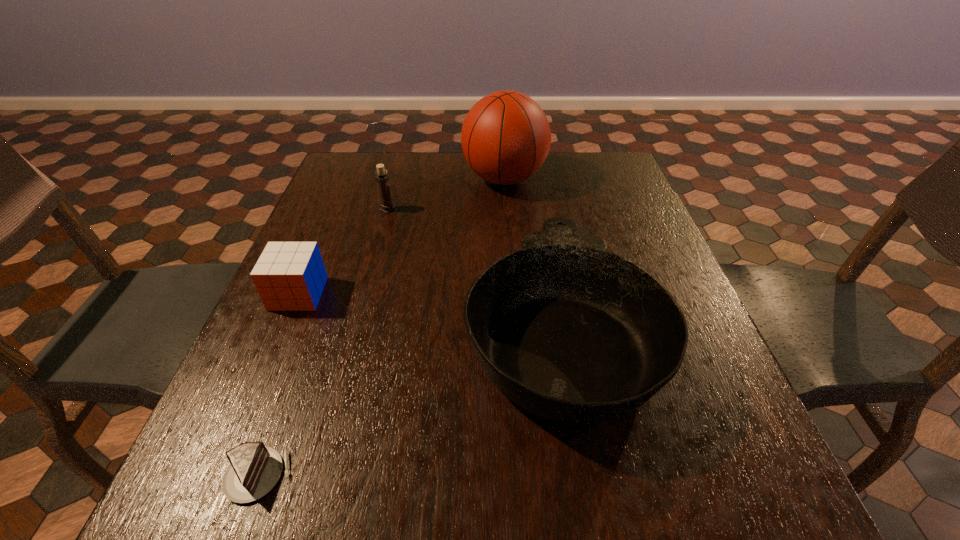
At what (x,y) coordinates should I click in order to perform the action: click on vacant position at the far edge of the desktop. Please return your answer as a coordinate pair (x, y). The height and width of the screenshot is (540, 960). Looking at the image, I should click on (446, 167).

This screenshot has height=540, width=960. Identify the location of vacant area at the near edge of the desktop. (303, 507).

The width and height of the screenshot is (960, 540). What are the coordinates of `vacant space at the left edge of the desktop` in the screenshot? It's located at (324, 236).

At what (x,y) coordinates should I click in order to perform the action: click on vacant region at the right edge of the desktop. Please return your answer as a coordinate pair (x, y). Looking at the image, I should click on (695, 374).

Where is `vacant space at the far left corner`? The width and height of the screenshot is (960, 540). vacant space at the far left corner is located at coordinates (357, 192).

Locate an element on the screen. The width and height of the screenshot is (960, 540). free space at the far right corner is located at coordinates (579, 164).

Where is `free space at the near right corner of the desktop`? free space at the near right corner of the desktop is located at coordinates (702, 482).

What are the coordinates of `vacant space that's between the basketball and the chocolate cake` in the screenshot? It's located at (381, 327).

Where is `empty space that is in between the frying pan and the cube`? empty space that is in between the frying pan and the cube is located at coordinates (429, 310).

Where is `unoccupied position between the third object from left to right and the chocolate cake`? This screenshot has height=540, width=960. unoccupied position between the third object from left to right and the chocolate cake is located at coordinates 323,342.